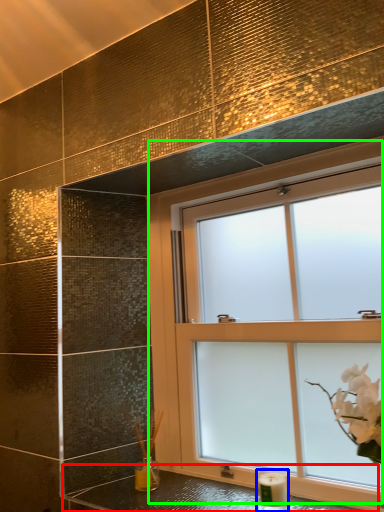
Question: Which object is positioned farthest from counter top (highlighted by a red box)? Select from candle holder (highlighted by a blue box) and window (highlighted by a green box).

Choices:
 (A) candle holder
 (B) window

Answer: (B)